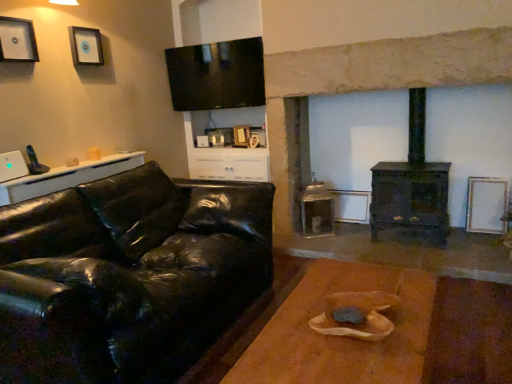
Question: Relative to black leather couch at left, is brushed metal picture frame at upper left, which ranks as the third picture frame in right-to-left order, in front or behind?

Choices:
 (A) behind
 (B) front

Answer: (A)

Question: From the image's perspective, relative to black leather couch at left, is brushed metal picture frame at upper left, which appears as the 1th picture frame when viewed from the front, above or below?

Choices:
 (A) below
 (B) above

Answer: (B)

Question: Which of these objects is positioned closest to the matte black cabinet at upper center?

Choices:
 (A) white matte picture frame at right, which appears as the third picture frame when viewed from the left
 (B) black leather couch at left
 (C) white glossy table at left, which is the second table from bottom to top
 (D) brown wooden table at center, the second table viewed from the top
 (E) brushed metal picture frame at upper left, positioned as the first picture frame in left-to-right order

Answer: (C)

Question: Estimate the real-world distances between objects in this image. Which object is farther from the white matte picture frame at right, marked as the 1th picture frame in a back-to-front arrangement?

Choices:
 (A) black leather couch at left
 (B) brushed metal picture frame at upper left, which appears as the 1th picture frame when viewed from the front
 (C) matte black cabinet at upper center
 (D) wooden picture frame at upper left, the 2th picture frame positioned from the front
 (E) white glossy table at left, which is the 1th table from top to bottom

Answer: (B)